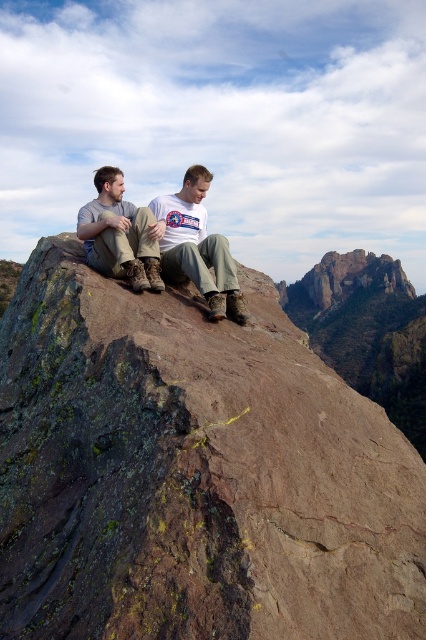
You are a hiker who wants to place a small GPS marker on the cliff edge. The GPS marker requires a flat surface at least 0.5 meters wide. Is the rusty rock at center suitable for placing the GPS marker?

The position of rusty rock at center is at point (192, 474). However, the provided information does not specify the width of the rusty rock at center. Therefore, it is unclear if the rusty rock at center has a flat surface wide enough to accommodate the GPS marker requiring 0.5 meters width.

You are a hiker who wants to place a small backpack between the rusty rock at center and the matte brown boots at left. According to the scene, where should you place it so it stays between them?

Place the backpack to the right of the matte brown boots at left since the rusty rock at center is to the right of it, keeping the backpack between them.